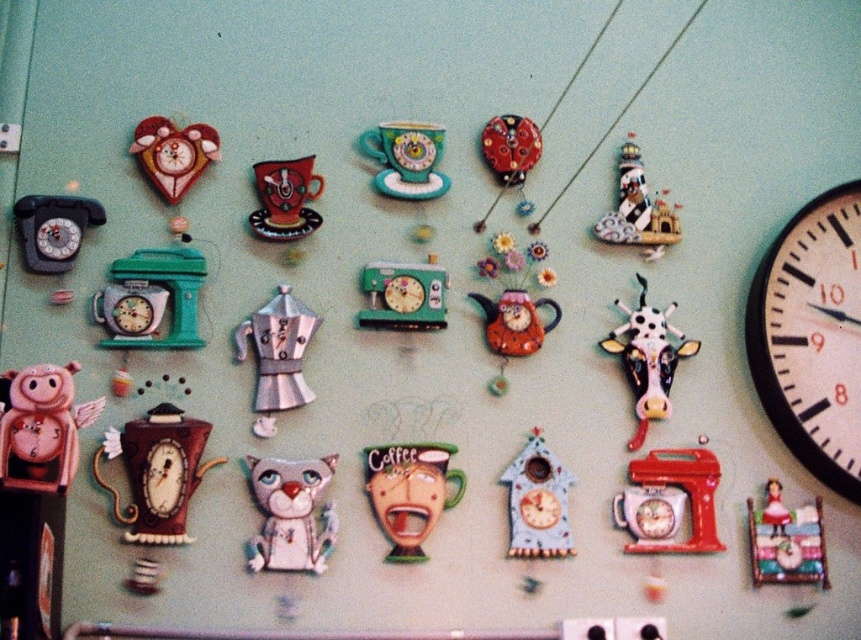
Between point (508, 522) and point (633, 208), which one is positioned in front?

Positioned in front is point (508, 522).

Which is in front, point (542, 442) or point (615, 214)?

Point (542, 442) is in front.

You are a GUI agent. You are given a task and a screenshot of the screen. Output one action in this format:
    pyautogui.click(x=<x>, y=<y>)
    Task: Click on the light blue wooden birdhouse at center
    The image size is (861, 640).
    Given the screenshot: What is the action you would take?
    pyautogui.click(x=537, y=502)

Is wooden clock at center-left to the right of light blue wooden birdhouse at center from the viewer's perspective?

Incorrect, wooden clock at center-left is not on the right side of light blue wooden birdhouse at center.

From the picture: Is wooden clock at center-left closer to camera compared to light blue wooden birdhouse at center?

Yes, it is.

What do you see at coordinates (156, 472) in the screenshot? I see `wooden clock at center-left` at bounding box center [156, 472].

This screenshot has height=640, width=861. Find the location of `wooden clock at center-left`. wooden clock at center-left is located at coordinates (156, 472).

Describe the element at coordinates (685, 490) in the screenshot. The height and width of the screenshot is (640, 861). I see `red matte mixer at center-right` at that location.

Find the location of a particular element. The image size is (861, 640). red matte mixer at center-right is located at coordinates (685, 490).

This screenshot has height=640, width=861. In order to click on red matte mixer at center-right in this screenshot , I will do `click(685, 490)`.